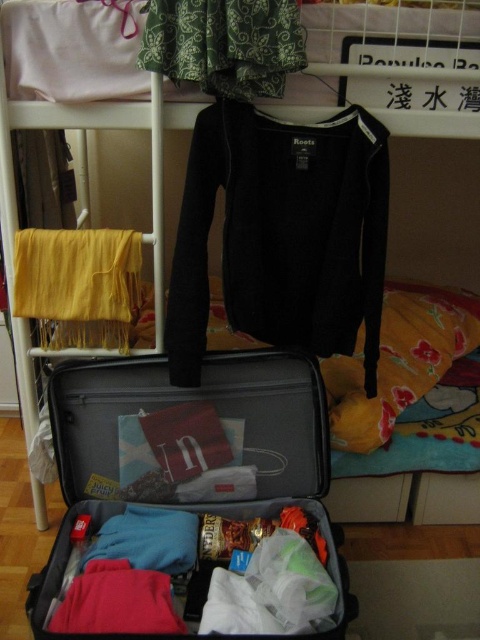
Question: Can you confirm if matte gray suitcase at center is wider than patterned fabric pants at upper center?

Choices:
 (A) no
 (B) yes

Answer: (B)

Question: In this image, where is matte gray suitcase at center located relative to patterned fabric pants at upper center?

Choices:
 (A) above
 (B) below

Answer: (B)

Question: Among these objects, which one is nearest to the camera?

Choices:
 (A) patterned fabric pants at upper center
 (B) black jersey at center

Answer: (A)

Question: Which point appears closest to the camera in this image?

Choices:
 (A) (99, 323)
 (B) (273, 464)
 (C) (339, 212)
 (D) (144, 10)

Answer: (D)

Question: Which object appears farthest from the camera in this image?

Choices:
 (A) yellow fabric at left
 (B) patterned fabric pants at upper center

Answer: (A)

Question: Can you confirm if black jersey at center is positioned above yellow fabric at left?

Choices:
 (A) yes
 (B) no

Answer: (A)